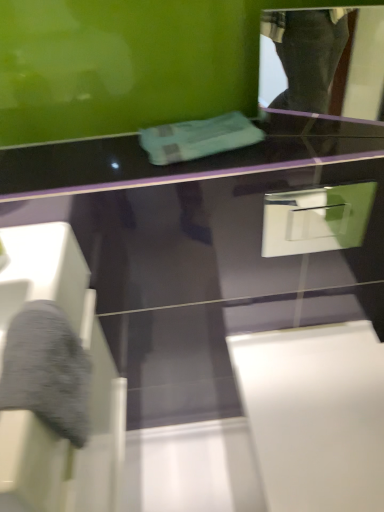
Question: Could you tell me if teal fabric towel at center is facing white glossy drawer at upper right?

Choices:
 (A) yes
 (B) no

Answer: (B)

Question: Does teal fabric towel at center have a lesser height compared to white glossy drawer at upper right?

Choices:
 (A) yes
 (B) no

Answer: (A)

Question: Is teal fabric towel at center at the right side of white glossy drawer at upper right?

Choices:
 (A) no
 (B) yes

Answer: (A)

Question: From the image's perspective, is teal fabric towel at center on top of white glossy drawer at upper right?

Choices:
 (A) no
 (B) yes

Answer: (B)

Question: Is teal fabric towel at center positioned far away from white glossy drawer at upper right?

Choices:
 (A) no
 (B) yes

Answer: (A)

Question: Considering the relative sizes of teal fabric towel at center and white glossy drawer at upper right in the image provided, is teal fabric towel at center smaller than white glossy drawer at upper right?

Choices:
 (A) yes
 (B) no

Answer: (A)

Question: Is white glossy drawer at upper right a part of glossy plastic mirror at upper right?

Choices:
 (A) no
 (B) yes

Answer: (A)

Question: Are glossy plastic mirror at upper right and white glossy drawer at upper right located far from each other?

Choices:
 (A) no
 (B) yes

Answer: (A)

Question: Is glossy plastic mirror at upper right at the left side of white glossy drawer at upper right?

Choices:
 (A) no
 (B) yes

Answer: (A)

Question: Is glossy plastic mirror at upper right positioned beyond the bounds of white glossy drawer at upper right?

Choices:
 (A) yes
 (B) no

Answer: (A)

Question: Does glossy plastic mirror at upper right have a lesser height compared to white glossy drawer at upper right?

Choices:
 (A) no
 (B) yes

Answer: (A)

Question: From the image's perspective, is glossy plastic mirror at upper right under white glossy drawer at upper right?

Choices:
 (A) no
 (B) yes

Answer: (A)

Question: Does teal fabric towel at center have a greater width compared to glossy plastic mirror at upper right?

Choices:
 (A) yes
 (B) no

Answer: (A)